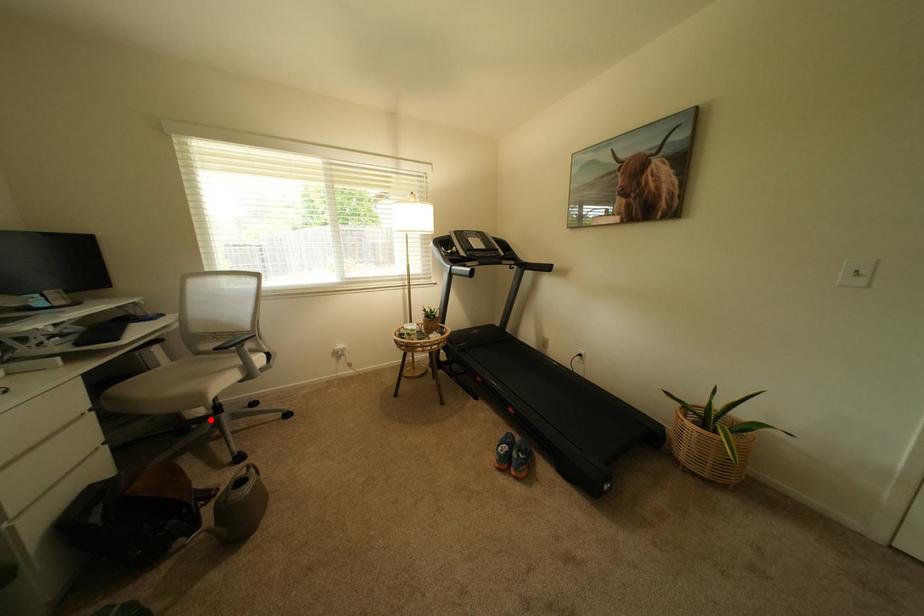
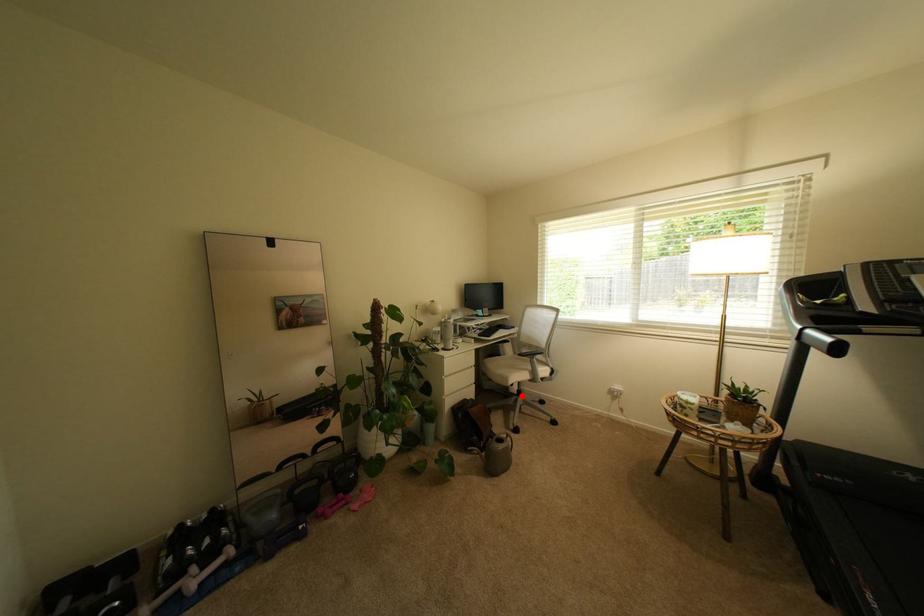
I am providing you with two images of the same scene from different viewpoints. A red point is marked on the first image and another point is marked on the second image. Is the red point in image1 aligned with the point shown in image2?

Yes